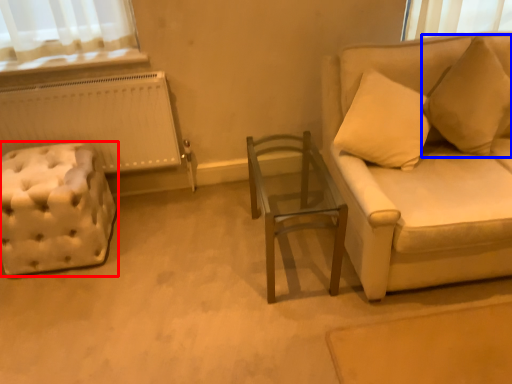
Question: Which of the following is the closest to the observer, furniture (highlighted by a red box) or pillow (highlighted by a blue box)?

Choices:
 (A) furniture
 (B) pillow

Answer: (B)